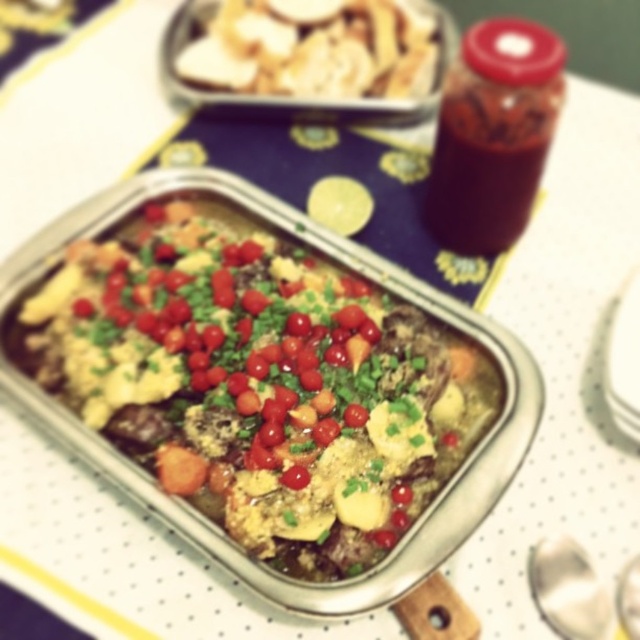
You are a food critic standing in front of the rectangular metal tray. You want to take a bite of the slightly browned baked dish at center and the white crumbly at upper center. Which one can you reach without moving your hand from your current position?

The slightly browned baked dish at center is closer to the viewer than the white crumbly at upper center, so you can reach it without moving your hand from your current position.

You are a delivery person who needs to pick up the slightly browned baked dish at center from the rectangular metal tray. The tray has a coordinate system where the bottom left corner is the origin. The coordinates of the dish are given as point 0.597, 0.405. If the tray is 1 meter long on each side, can you estimate the location of the dish in terms of left, center, or right position along the length of the tray?

The coordinates of the slightly browned baked dish at center are at point (259,381). Since the tray is 1 meter long on each side, the x coordinate 0.597 is closer to the right side of the tray. Therefore, the dish is positioned on the right side of the tray.

You are a food delivery person who needs to place a protective cover over the slightly browned baked dish at center and the white crumbly at upper center. The cover you have can only fit over items that are smaller than 10 inches in size. Based on the description, can both items fit under the cover?

The slightly browned baked dish at center has a larger size compared to white crumbly at upper center. Since the cover can only fit items smaller than 10 inches, we need to determine the size of the baked dish. However, the description does not provide specific measurements for either item. Therefore, it is uncertain if both items will fit under the cover.